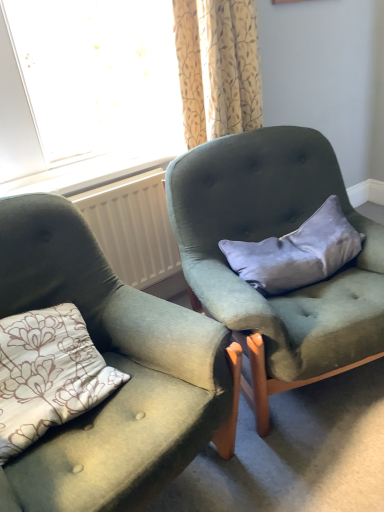
Question: Considering the positions of velvet green armchair at center, which is the first chair in right-to-left order, and velvet green armchair at center, acting as the 1th chair starting from the left, in the image, is velvet green armchair at center, which is the first chair in right-to-left order, bigger or smaller than velvet green armchair at center, acting as the 1th chair starting from the left,?

Choices:
 (A) big
 (B) small

Answer: (A)

Question: Is velvet green armchair at center, which is counted as the second chair, starting from the left, inside the boundaries of velvet green armchair at center, which is the 2th chair in right-to-left order, or outside?

Choices:
 (A) outside
 (B) inside

Answer: (A)

Question: Which is farther from the velvet green armchair at center, acting as the 1th chair starting from the left?

Choices:
 (A) velvet green armchair at center, which is the first chair in right-to-left order
 (B) velvet gray pillow at center
 (C) white plastic radiator at center
 (D) floral fabric curtain at upper center

Answer: (D)

Question: Estimate the real-world distances between objects in this image. Which object is closer to the velvet gray pillow at center?

Choices:
 (A) velvet green armchair at center, acting as the 1th chair starting from the left
 (B) velvet green armchair at center, which is counted as the second chair, starting from the left
 (C) white plastic radiator at center
 (D) floral fabric curtain at upper center

Answer: (B)